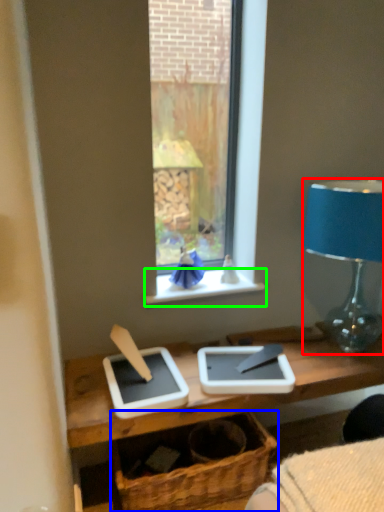
Question: Based on their relative distances, which object is farther from lamp (highlighted by a red box)? Choose from basket (highlighted by a blue box) and window sill (highlighted by a green box).

Choices:
 (A) basket
 (B) window sill

Answer: (A)